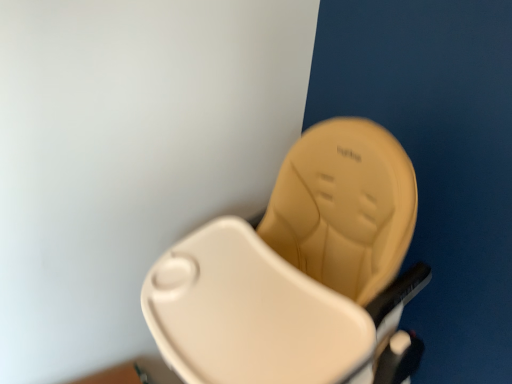
This screenshot has height=384, width=512. In order to click on beige plastic toilet at center in this screenshot , I will do 300,273.

What do you see at coordinates (300, 273) in the screenshot? This screenshot has width=512, height=384. I see `beige plastic toilet at center` at bounding box center [300, 273].

What are the coordinates of `beige plastic toilet at center` in the screenshot? It's located at click(x=300, y=273).